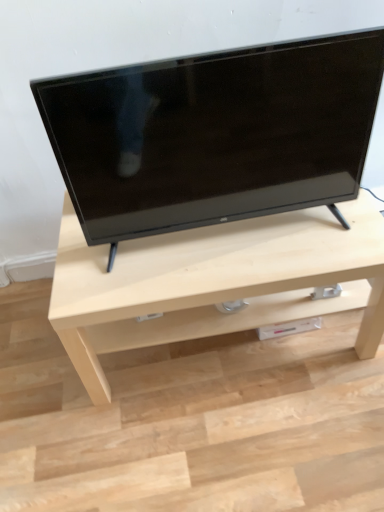
At what (x,y) coordinates should I click in order to perform the action: click on vacant area on top of light wood table at center (from a real-world perspective). Please return your answer as a coordinate pair (x, y). The image size is (384, 512). Looking at the image, I should click on (233, 239).